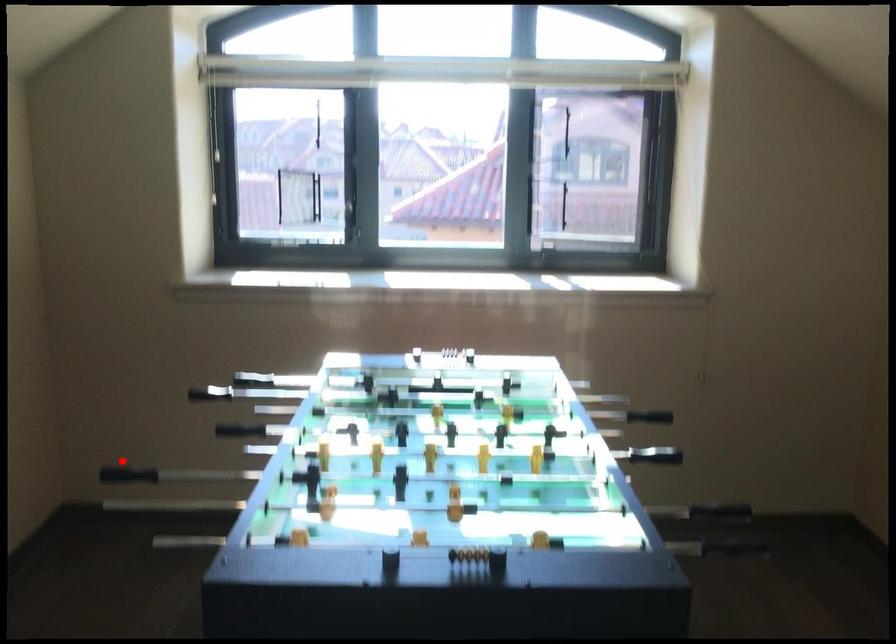
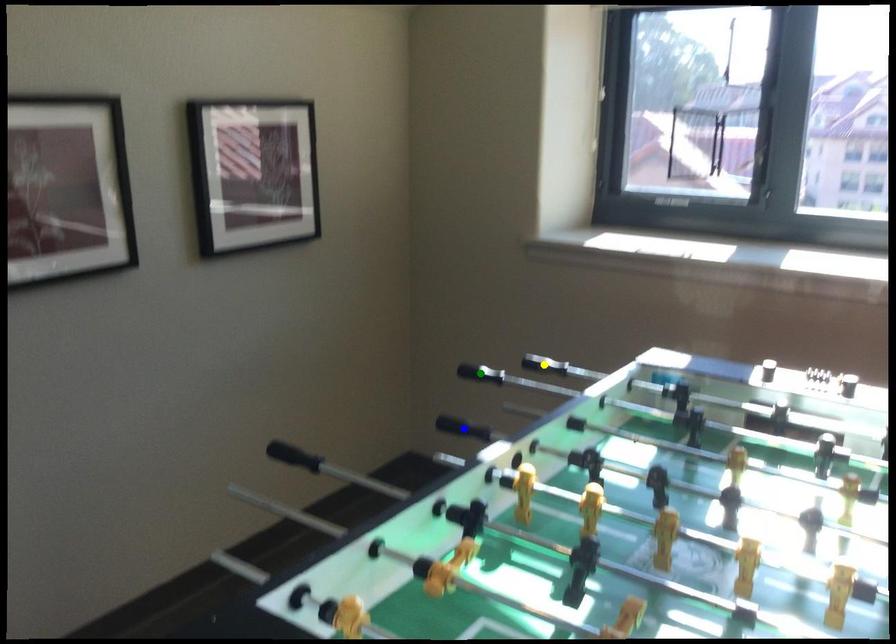
Question: I am providing you with two images of the same scene from different viewpoints. A red point is marked on the first image. You are given multiple points on the second image. Can you choose the point in image 2 that corresponds to the point in image 1?

Choices:
 (A) yellow point
 (B) green point
 (C) blue point

Answer: (C)